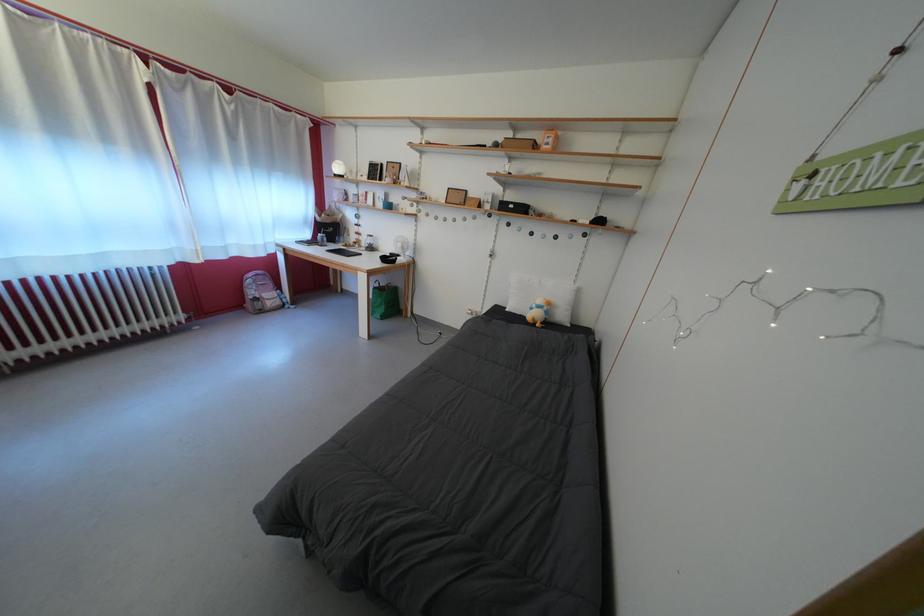
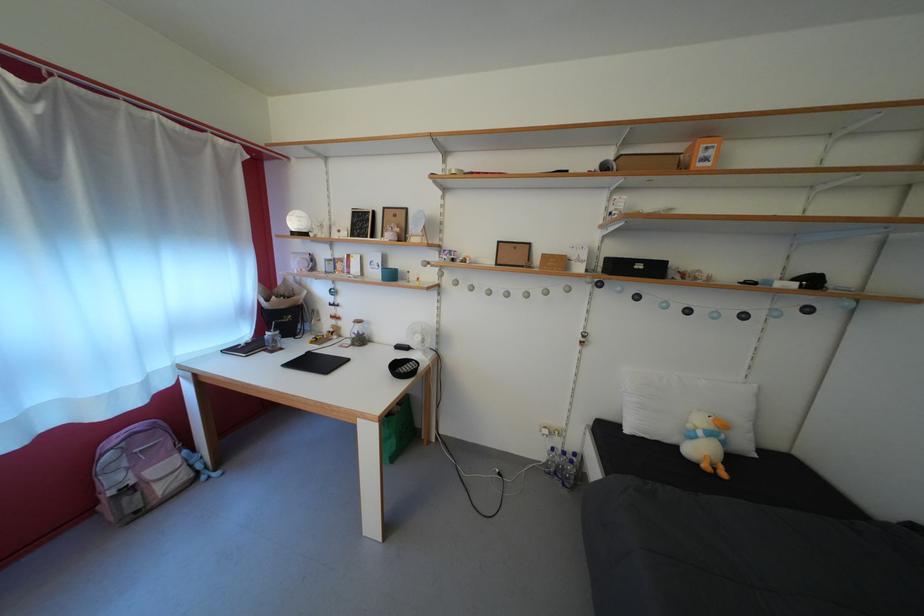
Find the pixel in the second image that matches pixel 407 251 in the first image.

(427, 344)